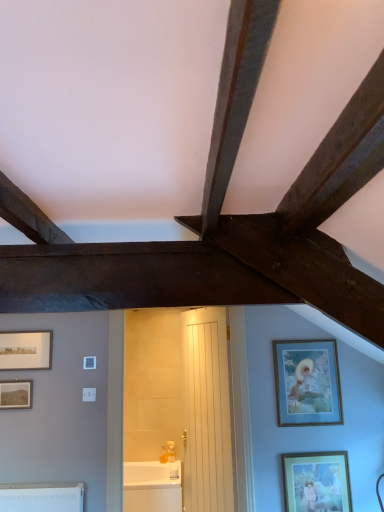
Question: Considering the positions of point (23, 364) and point (21, 407), is point (23, 364) closer or farther from the camera than point (21, 407)?

Choices:
 (A) farther
 (B) closer

Answer: (A)

Question: In the image, is matte silver picture frame at left, which is the 1th picture frame from left to right, on the left side or the right side of matte brown picture frame at lower left, the second picture frame positioned from the bottom?

Choices:
 (A) left
 (B) right

Answer: (A)

Question: Which of these objects is positioned closest to the white glossy bathtub at center?

Choices:
 (A) matte silver picture frame at left, which is the 1th picture frame from left to right
 (B) matte gold picture frame at lower right, acting as the fourth picture frame starting from the left
 (C) wooden frame at right, marked as the 3th picture frame in a bottom-to-top arrangement
 (D) white wooden door at center
 (E) matte brown picture frame at lower left, which is counted as the 3th picture frame, starting from the right

Answer: (D)

Question: Estimate the real-world distances between objects in this image. Which object is farther from the wooden frame at right, which ranks as the second picture frame in right-to-left order?

Choices:
 (A) white wooden door at center
 (B) matte brown picture frame at lower left, acting as the second picture frame starting from the left
 (C) white glossy bathtub at center
 (D) matte silver picture frame at left, which is the fourth picture frame in bottom-to-top order
 (E) matte gold picture frame at lower right, which is the first picture frame in bottom-to-top order

Answer: (B)